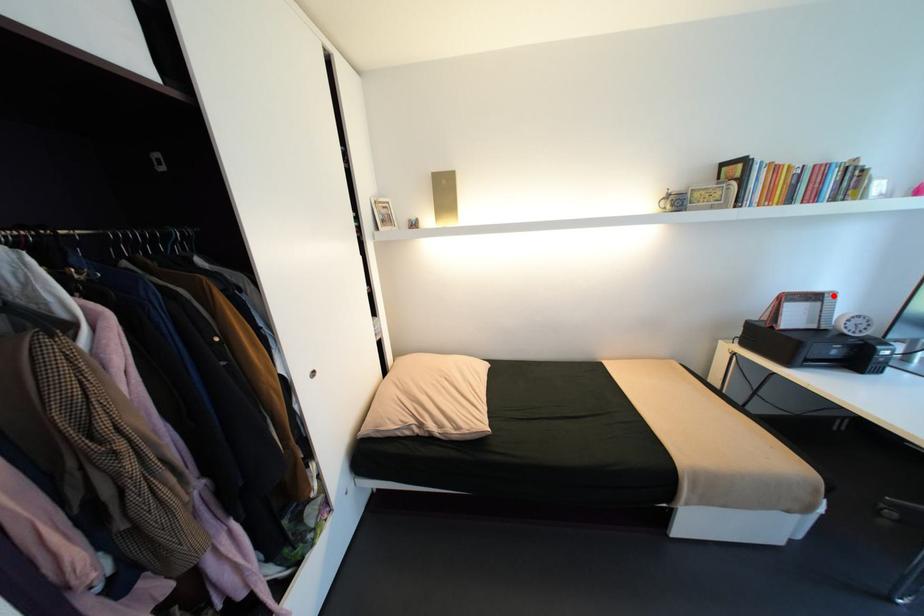
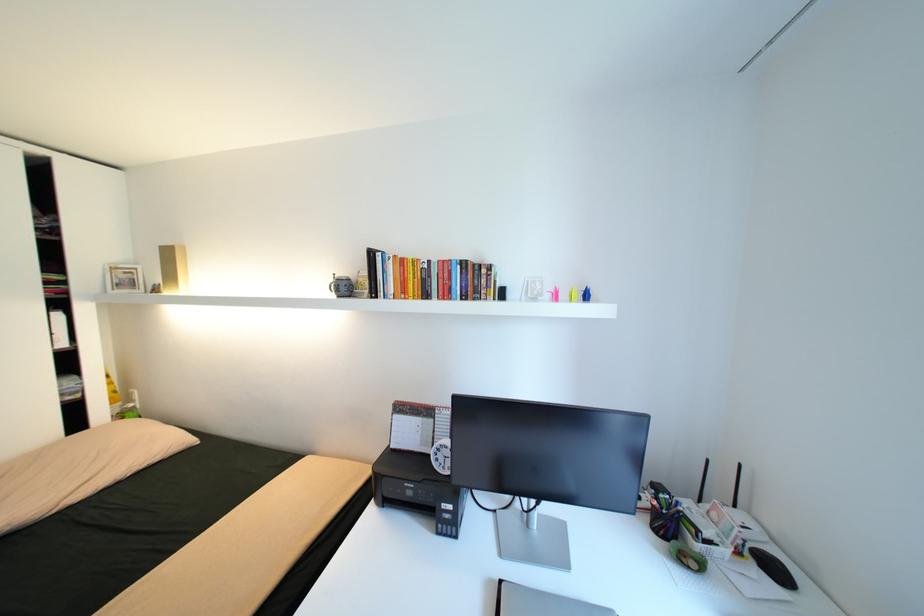
Question: I am providing you with two images of the same scene from different viewpoints. Image1 has a red point marked. In image2, the corresponding 3D location appears at what relative position? Reply with the corresponding letter.

Choices:
 (A) Closer
 (B) Farther

Answer: (B)